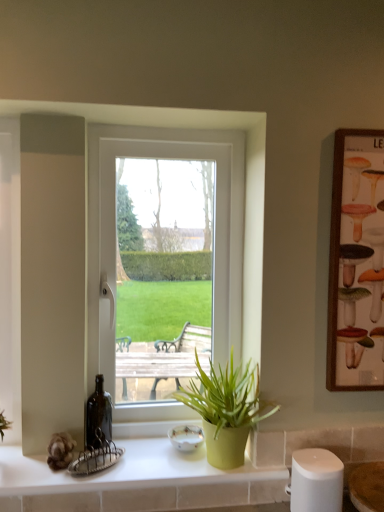
You are a GUI agent. You are given a task and a screenshot of the screen. Output one action in this format:
    pyautogui.click(x=<x>, y=<y>)
    Task: Click on the white glossy countertop at lower center
    The image size is (384, 512).
    Given the screenshot: What is the action you would take?
    pyautogui.click(x=137, y=482)

What do you see at coordinates (137, 482) in the screenshot? This screenshot has width=384, height=512. I see `white glossy countertop at lower center` at bounding box center [137, 482].

This screenshot has height=512, width=384. What do you see at coordinates (101, 220) in the screenshot?
I see `white plastic window at center` at bounding box center [101, 220].

Image resolution: width=384 pixels, height=512 pixels. What do you see at coordinates (225, 410) in the screenshot? I see `green matte pot at lower center` at bounding box center [225, 410].

Identify the location of wooden framed poster at right. [x=356, y=263].

Does white plastic window at center turn towards green matte pot at lower center?

Yes, white plastic window at center faces towards green matte pot at lower center.

Does white plastic window at center contain green matte pot at lower center?

No, green matte pot at lower center is not a part of white plastic window at center.

Is white plastic window at center bigger or smaller than green matte pot at lower center?

Clearly, white plastic window at center is larger in size than green matte pot at lower center.

From the image's perspective, is white plastic window at center located beneath green matte pot at lower center?

No.

Does white glossy countertop at lower center have a greater height compared to wooden framed poster at right?

Incorrect, the height of white glossy countertop at lower center is not larger of that of wooden framed poster at right.

Is white glossy countertop at lower center to the left of wooden framed poster at right from the viewer's perspective?

Yes, white glossy countertop at lower center is to the left of wooden framed poster at right.

In the scene shown: Are white glossy countertop at lower center and wooden framed poster at right making contact?

No, white glossy countertop at lower center is not next to wooden framed poster at right.

At what (x,y) coordinates should I click in order to perform the action: click on picture frame above the white glossy countertop at lower center (from a real-world perspective). Please return your answer as a coordinate pair (x, y). Looking at the image, I should click on (356, 263).

Locate an element on the screen. This screenshot has width=384, height=512. picture frame above the white glossy countertop at lower center (from a real-world perspective) is located at coordinates (356, 263).

From a real-world perspective, is wooden framed poster at right positioned under white glossy countertop at lower center based on gravity?

No, from a real-world perspective, wooden framed poster at right is not under white glossy countertop at lower center.

Which object is further away from the camera, wooden framed poster at right or white glossy countertop at lower center?

wooden framed poster at right is more distant.

Between point (354, 289) and point (178, 496), which one is positioned behind?

The point (178, 496) is more distant.

Is green matte pot at lower center facing away from white plastic window at center?

Yes.

Is green matte pot at lower center not close to white plastic window at center?

No.

From the picture: From a real-world perspective, is green matte pot at lower center beneath white plastic window at center?

Indeed, from a real-world perspective, green matte pot at lower center is positioned beneath white plastic window at center.

Identify the location of houseplant located on the right of white plastic window at center. The image size is (384, 512). (225, 410).

Measure the distance from white glossy countertop at lower center to green matte pot at lower center.

7.61 inches.

From a real-world perspective, between white glossy countertop at lower center and green matte pot at lower center, who is vertically higher?

green matte pot at lower center is physically above.

From the image's perspective, which is above, white glossy countertop at lower center or green matte pot at lower center?

From the image's view, green matte pot at lower center is above.

You are a GUI agent. You are given a task and a screenshot of the screen. Output one action in this format:
    pyautogui.click(x=<x>, y=<y>)
    Task: Click on the counter top in front of the green matte pot at lower center
    The height and width of the screenshot is (512, 384).
    Given the screenshot: What is the action you would take?
    pyautogui.click(x=137, y=482)

Considering their positions, is white plastic window at center located in front of or behind wooden framed poster at right?

Clearly, white plastic window at center is behind wooden framed poster at right.

The width and height of the screenshot is (384, 512). In the image, there is a wooden framed poster at right. In order to click on window below it (from the image's perspective) in this screenshot , I will do `click(101, 220)`.

How many degrees apart are the facing directions of white plastic window at center and wooden framed poster at right?

0.163 degrees.

Is white plastic window at center at the left side of wooden framed poster at right?

Indeed, white plastic window at center is positioned on the left side of wooden framed poster at right.

Which is less distant, (238, 452) or (345, 250)?

Point (238, 452) is farther from the camera than point (345, 250).

From a real-world perspective, which is physically above, green matte pot at lower center or wooden framed poster at right?

wooden framed poster at right, from a real-world perspective.

Relative to wooden framed poster at right, is green matte pot at lower center in front or behind?

green matte pot at lower center is in front of wooden framed poster at right.

Looking at this image, how far apart are green matte pot at lower center and wooden framed poster at right?

A distance of 14.34 inches exists between green matte pot at lower center and wooden framed poster at right.

Locate an element on the screen. houseplant beneath the white plastic window at center (from a real-world perspective) is located at coordinates (225, 410).

Where is `counter top that is in front of the wooden framed poster at right`? counter top that is in front of the wooden framed poster at right is located at coordinates (137, 482).

Looking at the image, which one is located closer to wooden framed poster at right, green matte pot at lower center or white plastic window at center?

green matte pot at lower center is closer to wooden framed poster at right.

Looking at the image, which one is located further to white plastic window at center, wooden framed poster at right or white glossy countertop at lower center?

wooden framed poster at right lies further to white plastic window at center than the other object.

Which object lies further to the anchor point green matte pot at lower center, wooden framed poster at right or white plastic window at center?

wooden framed poster at right is further to green matte pot at lower center.

When comparing their distances from white glossy countertop at lower center, does green matte pot at lower center or wooden framed poster at right seem closer?

green matte pot at lower center.

Estimate the real-world distances between objects in this image. Which object is closer to green matte pot at lower center, white plastic window at center or wooden framed poster at right?

Among the two, white plastic window at center is located nearer to green matte pot at lower center.

Looking at the image, which one is located further to white glossy countertop at lower center, green matte pot at lower center or white plastic window at center?

white plastic window at center.

From the image, which object appears to be farther from white glossy countertop at lower center, wooden framed poster at right or green matte pot at lower center?

Based on the image, wooden framed poster at right appears to be further to white glossy countertop at lower center.

From the image, which object appears to be farther from white plastic window at center, green matte pot at lower center or white glossy countertop at lower center?

white glossy countertop at lower center is positioned further to the anchor white plastic window at center.

You are a GUI agent. You are given a task and a screenshot of the screen. Output one action in this format:
    pyautogui.click(x=<x>, y=<y>)
    Task: Click on the houseplant located between white plastic window at center and wooden framed poster at right in the left-right direction
    
    Given the screenshot: What is the action you would take?
    pyautogui.click(x=225, y=410)

Find the location of `window located between white glossy countertop at lower center and wooden framed poster at right in the left-right direction`. window located between white glossy countertop at lower center and wooden framed poster at right in the left-right direction is located at coordinates (101, 220).

Locate an element on the screen. houseplant between wooden framed poster at right and white glossy countertop at lower center vertically is located at coordinates (225, 410).

Locate an element on the screen. The height and width of the screenshot is (512, 384). houseplant that lies between white plastic window at center and white glossy countertop at lower center from top to bottom is located at coordinates (225, 410).